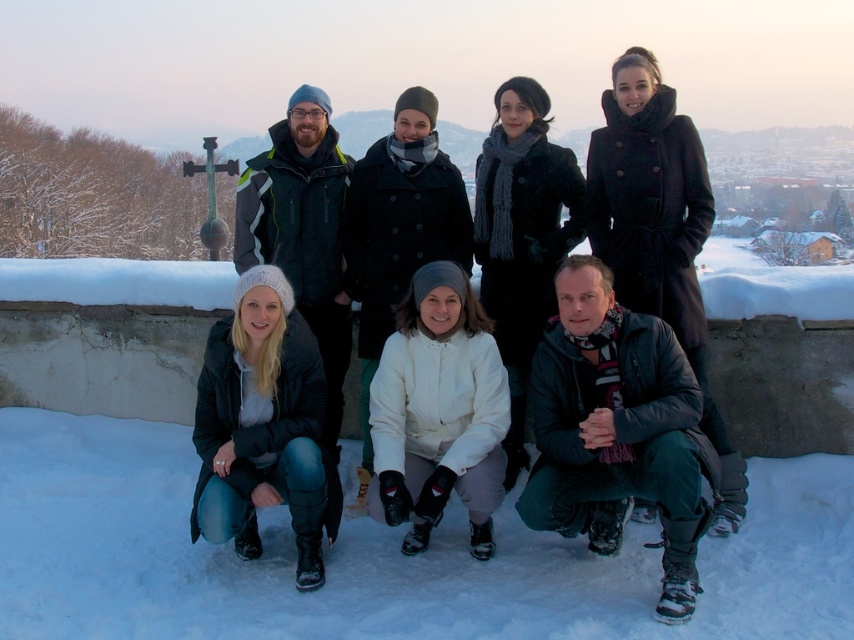
Can you confirm if matte black coat at center is wider than white matte jacket at center?

Indeed, matte black coat at center has a greater width compared to white matte jacket at center.

Between matte black coat at center and white matte jacket at center, which one appears on the left side from the viewer's perspective?

Positioned to the left is white matte jacket at center.

Find the location of a particular element. matte black coat at center is located at coordinates (621, 348).

Locate an element on the screen. This screenshot has width=854, height=640. white fluffy snow at lower center is located at coordinates (379, 556).

Is white fluffy snow at lower center taller than white matte jacket at center?

In fact, white fluffy snow at lower center may be shorter than white matte jacket at center.

The height and width of the screenshot is (640, 854). I want to click on white fluffy snow at lower center, so click(379, 556).

Is matte black coat at center smaller than matte black jacket at lower left?

No.

Who is positioned more to the left, matte black coat at center or matte black jacket at lower left?

Positioned to the left is matte black jacket at lower left.

Who is more distant from viewer, (x=683, y=346) or (x=206, y=532)?

The point (x=683, y=346) is behind.

Find the location of `matte black coat at center`. matte black coat at center is located at coordinates (621, 348).